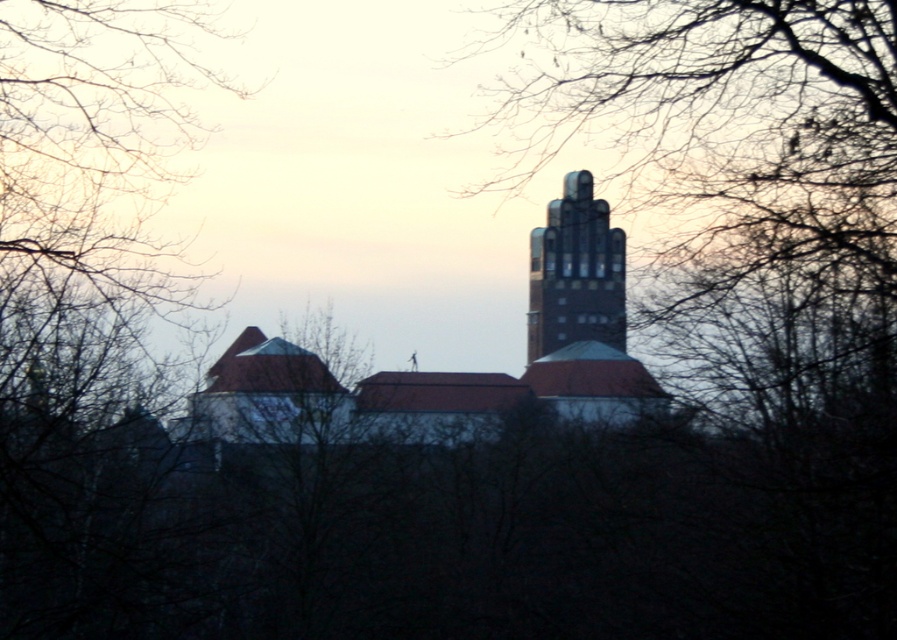
Does brown textured church at center have a greater height compared to dark brick tower at center?

Indeed, brown textured church at center has a greater height compared to dark brick tower at center.

How much distance is there between brown textured church at center and dark brick tower at center?

3.90 feet

In order to click on brown textured church at center in this screenshot , I will do `click(455, 371)`.

This screenshot has width=897, height=640. Identify the location of brown textured church at center. [x=455, y=371].